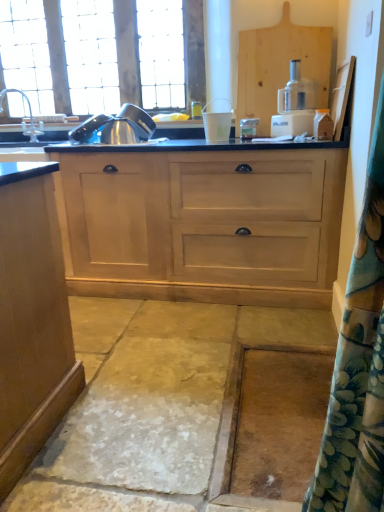
Question: Would you say white plastic cup at center, placed as the second appliance when sorted from left to right, contains stainless steel kettle at upper left, which is the second appliance from right to left?

Choices:
 (A) yes
 (B) no

Answer: (B)

Question: From the image's perspective, does white plastic cup at center, acting as the 1th appliance starting from the right, appear lower than stainless steel kettle at upper left, the first appliance from the left?

Choices:
 (A) no
 (B) yes

Answer: (B)

Question: Does white plastic cup at center, acting as the 1th appliance starting from the right, have a lesser height compared to stainless steel kettle at upper left, the first appliance from the left?

Choices:
 (A) no
 (B) yes

Answer: (B)

Question: From the image's perspective, is white plastic cup at center, acting as the 1th appliance starting from the right, located above stainless steel kettle at upper left, the first appliance from the left?

Choices:
 (A) no
 (B) yes

Answer: (A)

Question: From a real-world perspective, is smooth stone concrete at center physically located above or below stainless steel kettle at upper left, which is the second appliance from right to left?

Choices:
 (A) above
 (B) below

Answer: (B)

Question: From the image's perspective, is smooth stone concrete at center positioned above or below stainless steel kettle at upper left, which is the second appliance from right to left?

Choices:
 (A) above
 (B) below

Answer: (B)

Question: Is smooth stone concrete at center inside the boundaries of stainless steel kettle at upper left, which is the second appliance from right to left, or outside?

Choices:
 (A) inside
 (B) outside

Answer: (B)

Question: In terms of width, does smooth stone concrete at center look wider or thinner when compared to stainless steel kettle at upper left, which is the second appliance from right to left?

Choices:
 (A) wide
 (B) thin

Answer: (A)

Question: In the image, is silver metallic faucet at left on the left side or the right side of smooth stone concrete at center?

Choices:
 (A) right
 (B) left

Answer: (B)

Question: Is point (3, 90) positioned closer to the camera than point (148, 389)?

Choices:
 (A) farther
 (B) closer

Answer: (A)

Question: From a real-world perspective, is silver metallic faucet at left above or below smooth stone concrete at center?

Choices:
 (A) above
 (B) below

Answer: (A)

Question: Considering their positions, is silver metallic faucet at left located in front of or behind smooth stone concrete at center?

Choices:
 (A) behind
 (B) front

Answer: (A)

Question: From their relative heights in the image, would you say white plastic cup at center, acting as the 1th appliance starting from the right, is taller or shorter than clear glass window at upper left?

Choices:
 (A) tall
 (B) short

Answer: (B)

Question: Based on their positions, is white plastic cup at center, acting as the 1th appliance starting from the right, located to the left or right of clear glass window at upper left?

Choices:
 (A) right
 (B) left

Answer: (A)